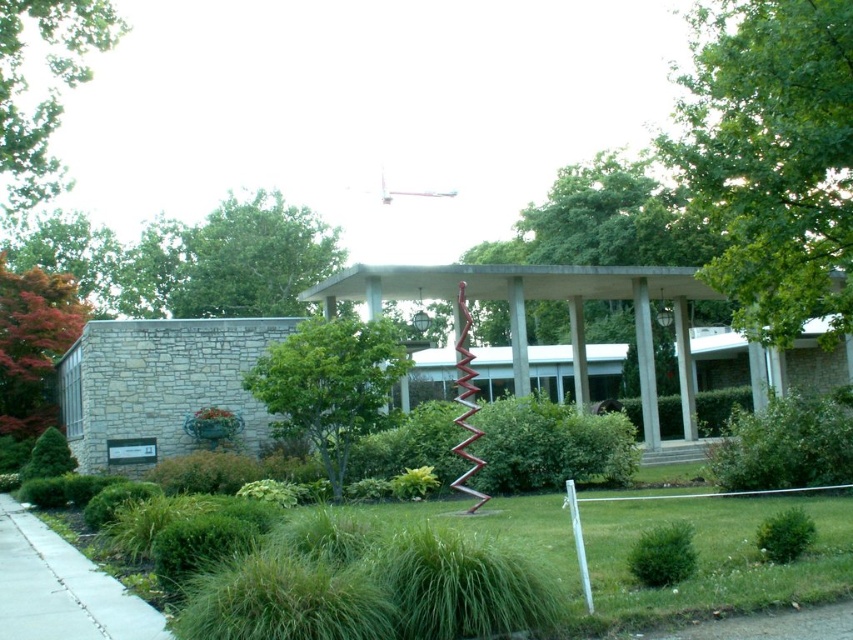
Which is below, green leafy tree at upper left or gray concrete sidewalk at lower left?

gray concrete sidewalk at lower left is below.

Is green leafy tree at upper left smaller than gray concrete sidewalk at lower left?

No.

Does point (28, 170) come farther from viewer compared to point (114, 628)?

Yes, point (28, 170) is farther from viewer.

Locate an element on the screen. The height and width of the screenshot is (640, 853). green leafy tree at upper left is located at coordinates tap(44, 88).

Is point (340, 412) positioned after point (105, 616)?

Yes, point (340, 412) is farther from viewer.

Between point (386, 371) and point (50, 538), which one is positioned in front?

Point (50, 538) is more forward.

Between point (334, 371) and point (1, 500), which one is positioned behind?

The point (1, 500) is more distant.

Where is `green leafy tree at center`? green leafy tree at center is located at coordinates click(x=329, y=385).

Which of these two, green leafy tree at upper left or reddish-brown bark tree at left, stands shorter?

reddish-brown bark tree at left is shorter.

Can you confirm if green leafy tree at upper left is bigger than reddish-brown bark tree at left?

Indeed, green leafy tree at upper left has a larger size compared to reddish-brown bark tree at left.

I want to click on green leafy tree at upper left, so click(x=44, y=88).